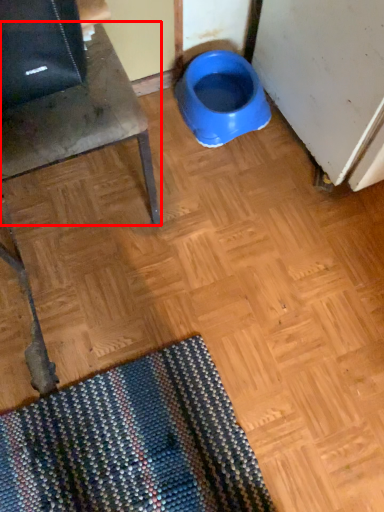
Question: From the image, what is the correct spatial relationship of furniture (annotated by the red box) in relation to toilet?

Choices:
 (A) left
 (B) right

Answer: (A)